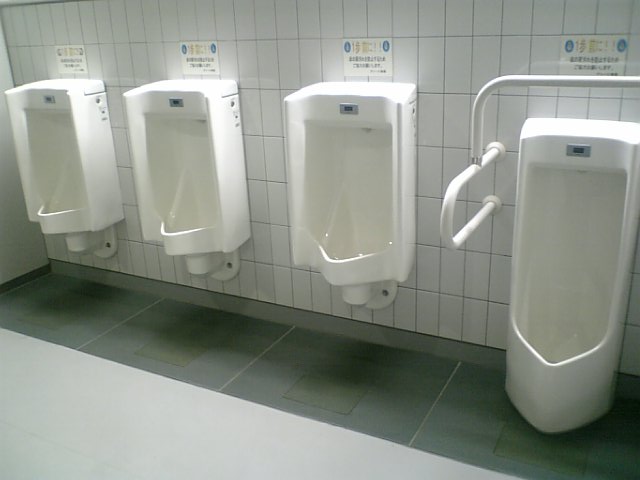
The width and height of the screenshot is (640, 480). I want to click on urinals in a bathroom, so click(x=63, y=163), click(x=169, y=169), click(x=331, y=173), click(x=585, y=243).